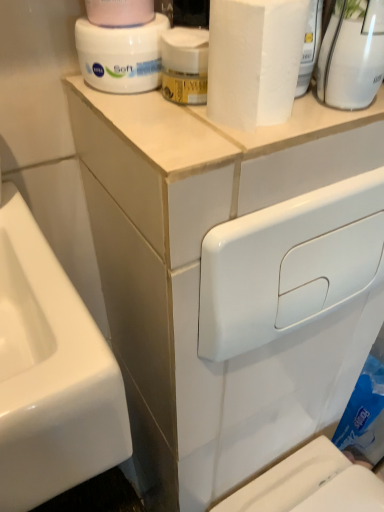
Question: Is white glossy toilet tank at upper center looking in the opposite direction of white matte paper towel at upper center?

Choices:
 (A) no
 (B) yes

Answer: (A)

Question: Is white glossy toilet tank at upper center beside white matte paper towel at upper center?

Choices:
 (A) no
 (B) yes

Answer: (A)

Question: Is white glossy toilet tank at upper center not inside white matte paper towel at upper center?

Choices:
 (A) yes
 (B) no

Answer: (A)

Question: Is white glossy toilet tank at upper center wider than white matte paper towel at upper center?

Choices:
 (A) no
 (B) yes

Answer: (A)

Question: Is white matte paper towel at upper center surrounded by white glossy toilet tank at upper center?

Choices:
 (A) no
 (B) yes

Answer: (A)

Question: Is white glossy toilet tank at upper center further to camera compared to white matte paper towel at upper center?

Choices:
 (A) yes
 (B) no

Answer: (A)

Question: Considering the relative sizes of white matte paper towel at upper center and white glossy vase at upper right, which appears as the first cleaning product when viewed from the right, in the image provided, is white matte paper towel at upper center thinner than white glossy vase at upper right, which appears as the first cleaning product when viewed from the right,?

Choices:
 (A) yes
 (B) no

Answer: (B)

Question: Can you confirm if white matte paper towel at upper center is positioned to the right of white glossy vase at upper right, the 2th cleaning product viewed from the left?

Choices:
 (A) no
 (B) yes

Answer: (A)

Question: From the image's perspective, is white matte paper towel at upper center above white glossy vase at upper right, which appears as the first cleaning product when viewed from the right?

Choices:
 (A) yes
 (B) no

Answer: (B)

Question: Is white matte paper towel at upper center aimed at white glossy vase at upper right, which appears as the first cleaning product when viewed from the right?

Choices:
 (A) yes
 (B) no

Answer: (B)

Question: Does white matte paper towel at upper center lie behind white glossy vase at upper right, which appears as the first cleaning product when viewed from the right?

Choices:
 (A) no
 (B) yes

Answer: (B)

Question: Considering the relative sizes of white matte paper towel at upper center and white glossy vase at upper right, the 2th cleaning product viewed from the left, in the image provided, is white matte paper towel at upper center shorter than white glossy vase at upper right, the 2th cleaning product viewed from the left,?

Choices:
 (A) yes
 (B) no

Answer: (A)

Question: From a real-world perspective, is white glossy toilet tank at upper center positioned over pink matte toilet paper at upper center based on gravity?

Choices:
 (A) no
 (B) yes

Answer: (A)